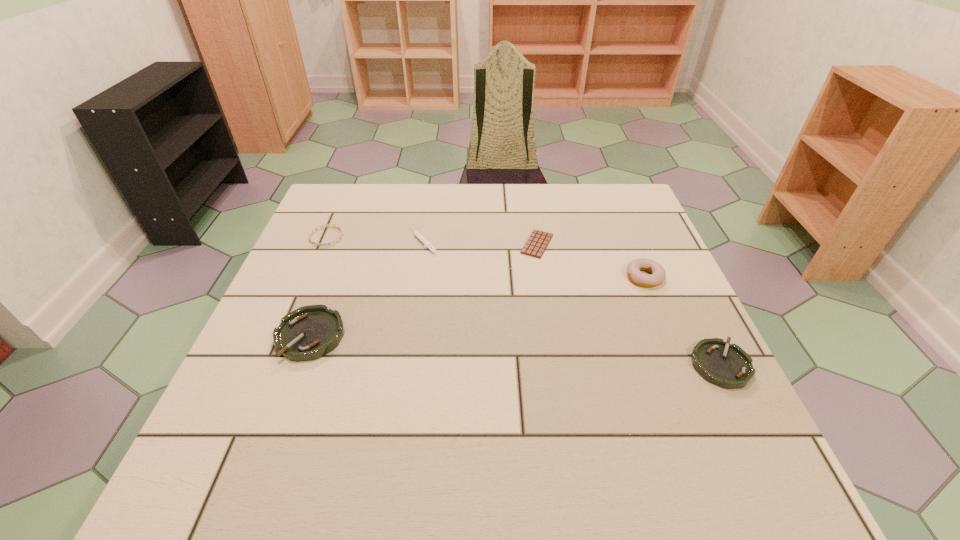
Identify the location of object present at the far left corner. This screenshot has height=540, width=960. (335, 225).

In the image, there is a desktop. Find the location of `vacant space at the far edge`. vacant space at the far edge is located at coordinates (383, 185).

Find the location of a particular element. This screenshot has width=960, height=540. free space at the near edge is located at coordinates tap(345, 414).

This screenshot has width=960, height=540. Identify the location of free space at the left edge of the desktop. (330, 233).

Where is `blank space at the far left corner of the desktop`? Image resolution: width=960 pixels, height=540 pixels. blank space at the far left corner of the desktop is located at coordinates (314, 216).

In order to click on free region at the far right corner of the desktop in this screenshot , I will do `click(625, 210)`.

What are the coordinates of `vacant space at the near right corner` in the screenshot? It's located at (662, 406).

What are the coordinates of `free space that is in between the bracelet and the left ashtray` in the screenshot? It's located at (319, 286).

Where is `free spot between the third object from right to left and the syringe`? Image resolution: width=960 pixels, height=540 pixels. free spot between the third object from right to left and the syringe is located at coordinates pos(480,242).

Identify the location of vacant area between the doughnut and the bracelet. (486, 257).